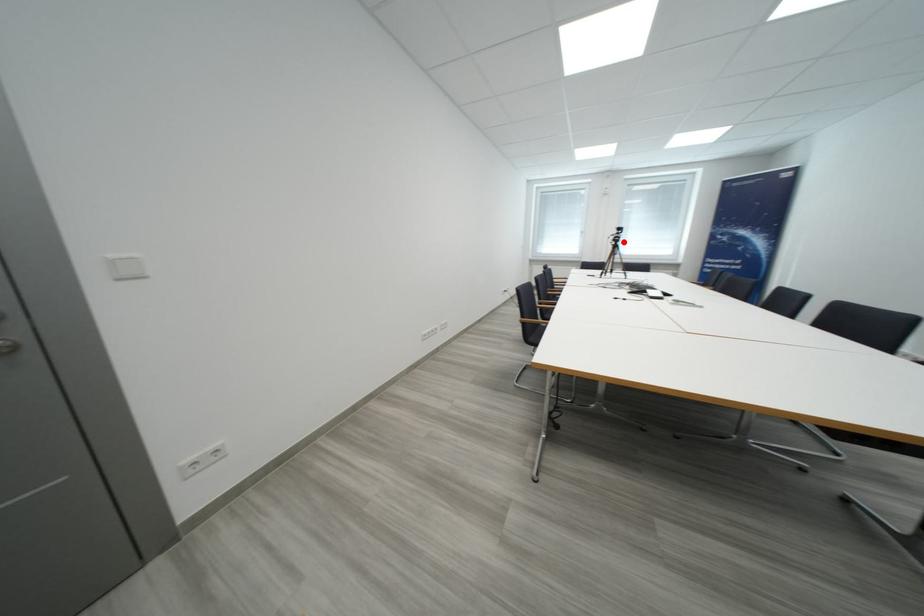
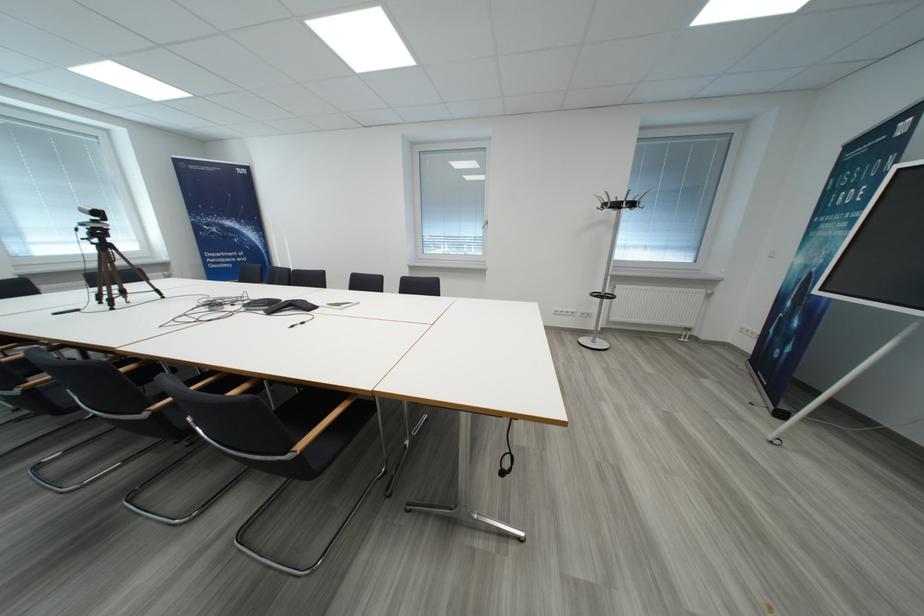
Find the pixel in the second image that matches the highlighted location in the first image.

(106, 236)